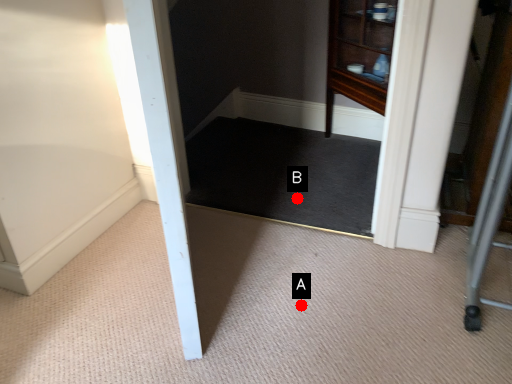
Question: Two points are circled on the image, labeled by A and B beside each circle. Which of the following is the farthest from the observer?

Choices:
 (A) A is further
 (B) B is further

Answer: (B)